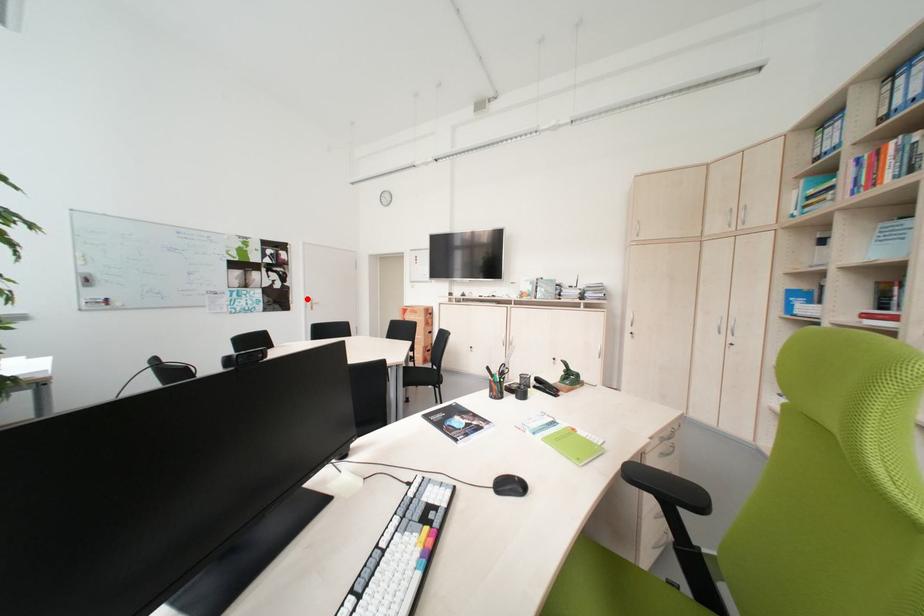
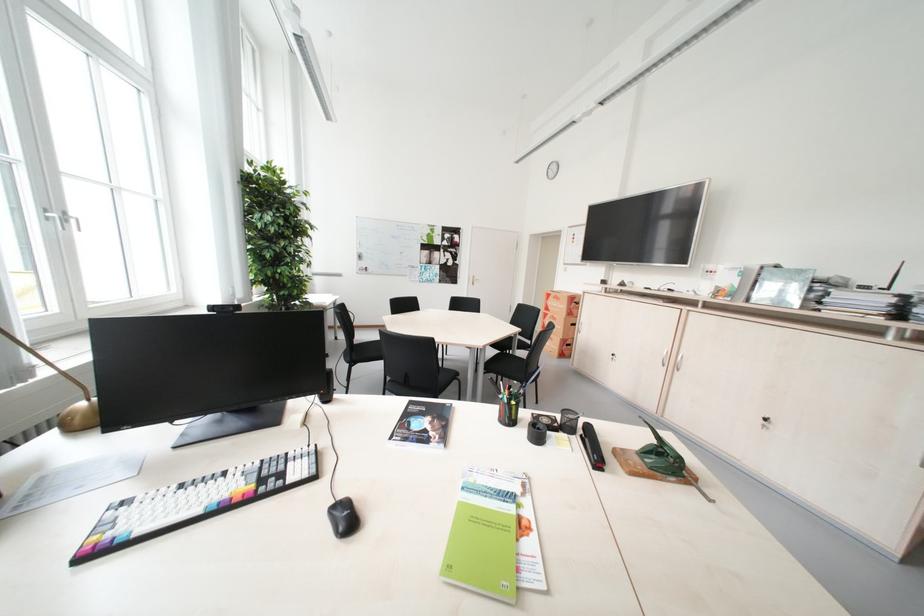
In the second image, find the point that corresponds to the highlighted location in the first image.

(473, 275)